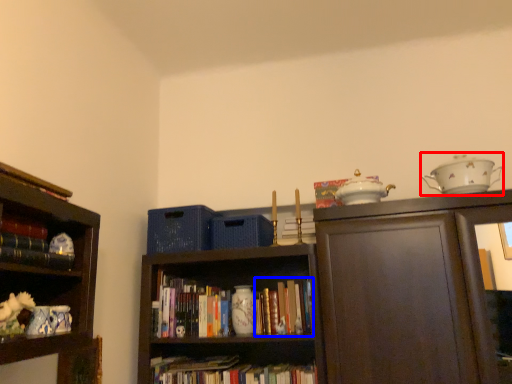
Question: Among these objects, which one is nearest to the camera, tea set (highlighted by a red box) or book (highlighted by a blue box)?

Choices:
 (A) tea set
 (B) book

Answer: (A)